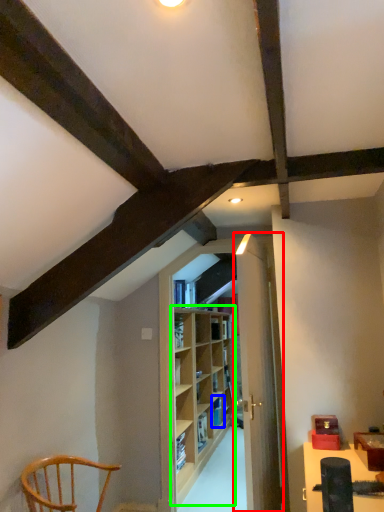
Question: Based on their relative distances, which object is nearer to door (highlighted by a red box)? Choose from shelf (highlighted by a blue box) and shelf (highlighted by a green box).

Choices:
 (A) shelf
 (B) shelf

Answer: (B)